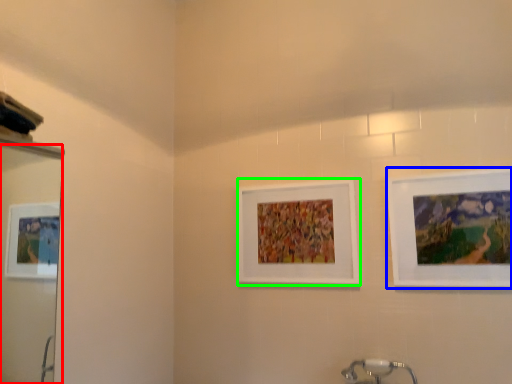
Question: Considering the real-world distances, which object is farthest from mirror (highlighted by a red box)? picture frame (highlighted by a blue box) or picture frame (highlighted by a green box)?

Choices:
 (A) picture frame
 (B) picture frame

Answer: (A)